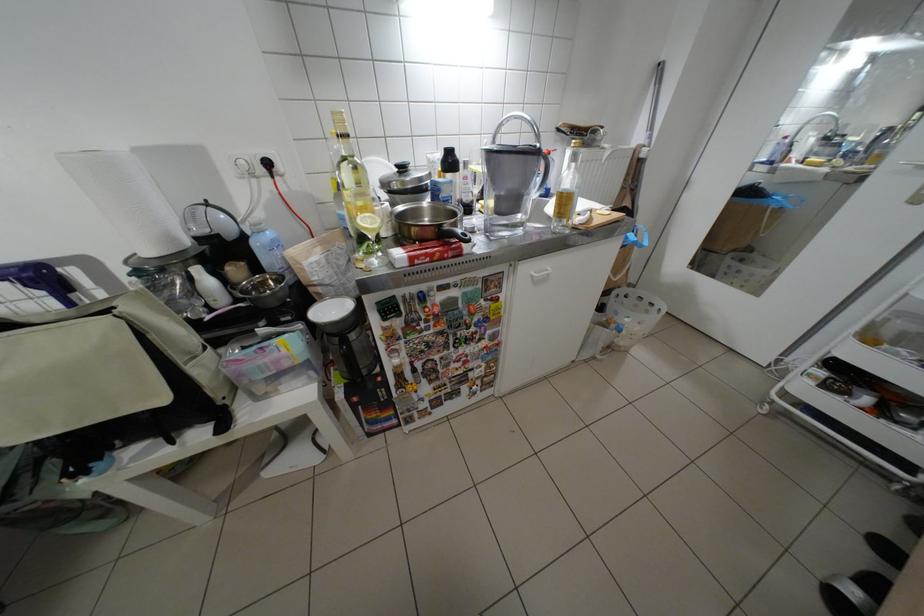
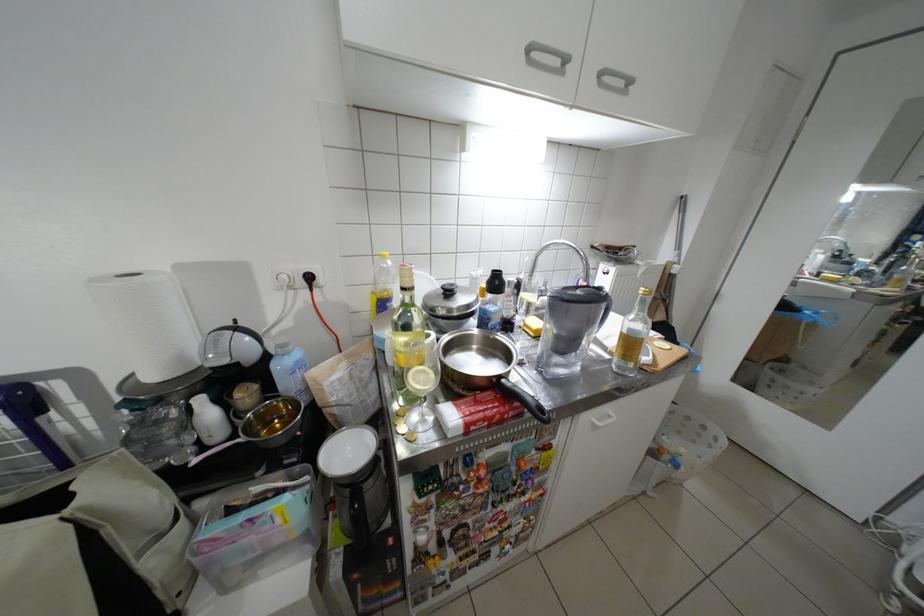
Locate, in the second image, the point that corresponds to point 407,167 in the first image.

(455, 290)